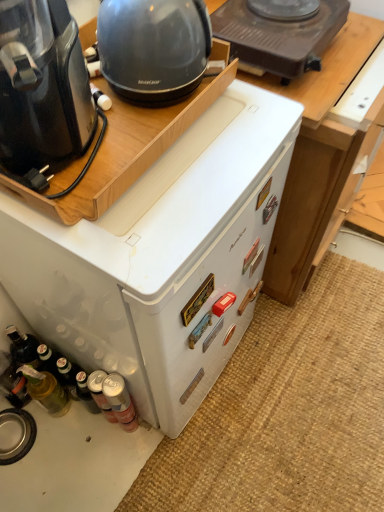
Locate an element on the screen. The image size is (384, 512). vacant area to the right of translucent glass bottle at lower left, acting as the first bottle starting from the left is located at coordinates (104, 438).